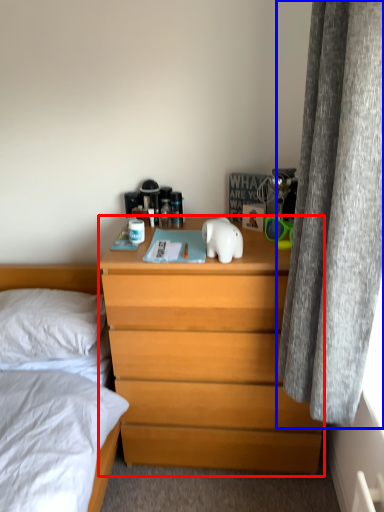
Question: Which object is further to the camera taking this photo, chest of drawers (highlighted by a red box) or curtain (highlighted by a blue box)?

Choices:
 (A) chest of drawers
 (B) curtain

Answer: (A)